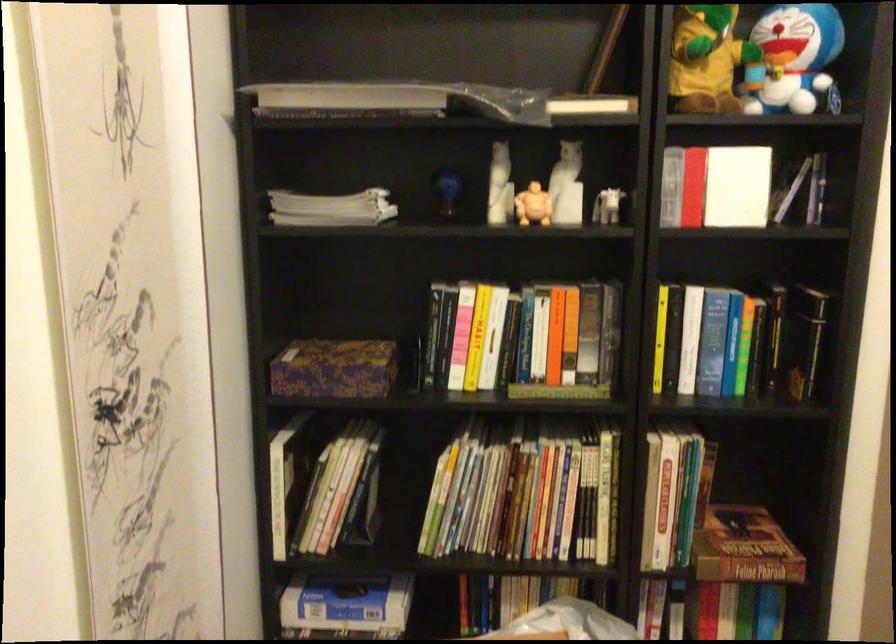
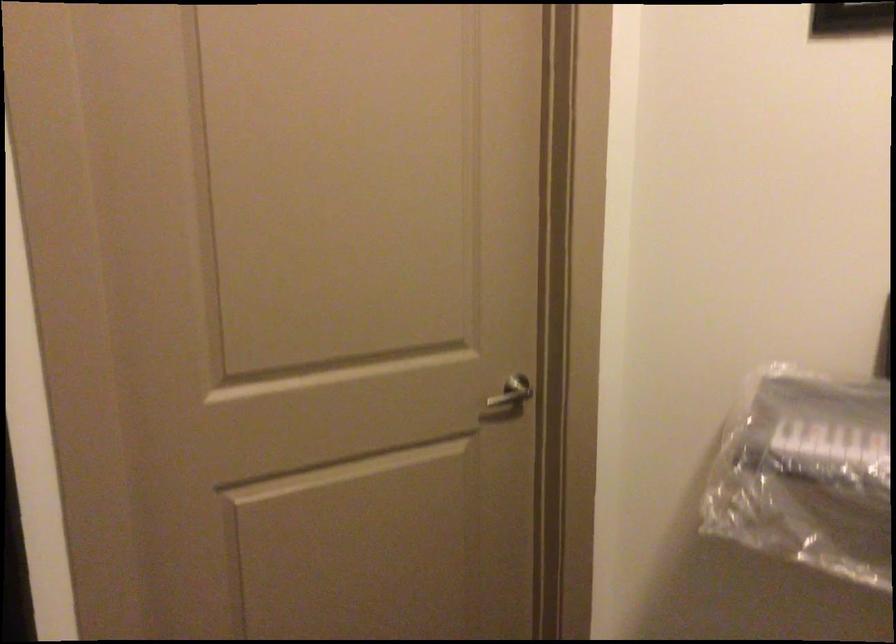
Question: The camera is either moving clockwise (left) or counter-clockwise (right) around the object. The first image is from the beginning of the video and the second image is from the end. Is the camera moving left or right when shooting the video?

Choices:
 (A) Left
 (B) Right

Answer: (A)